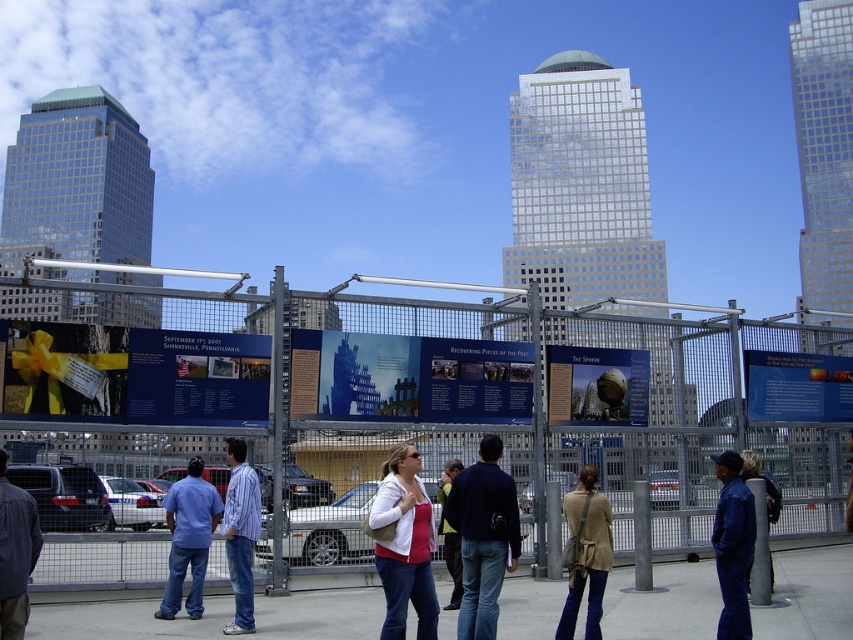
Question: Is matte white jacket at center thinner than blue denim jeans at lower right?

Choices:
 (A) no
 (B) yes

Answer: (B)

Question: Which object is the closest to the beige leather jacket at lower center?

Choices:
 (A) light brown leather jacket at center
 (B) denim shirt at lower left
 (C) matte white jacket at center
 (D) blue denim jumpsuit at right

Answer: (D)

Question: Which point appears closest to the camera in this image?

Choices:
 (A) (456, 548)
 (B) (497, 531)
 (C) (10, 545)
 (D) (728, 605)

Answer: (C)

Question: Based on their relative distances, which object is nearer to the beige leather jacket at lower center?

Choices:
 (A) blue jeans at center
 (B) blue striped shirt at center

Answer: (B)

Question: Is matte white jacket at center closer to the viewer compared to light brown leather jacket at center?

Choices:
 (A) no
 (B) yes

Answer: (B)

Question: Is dark blue jacket at center positioned in front of denim shirt at lower left?

Choices:
 (A) no
 (B) yes

Answer: (A)